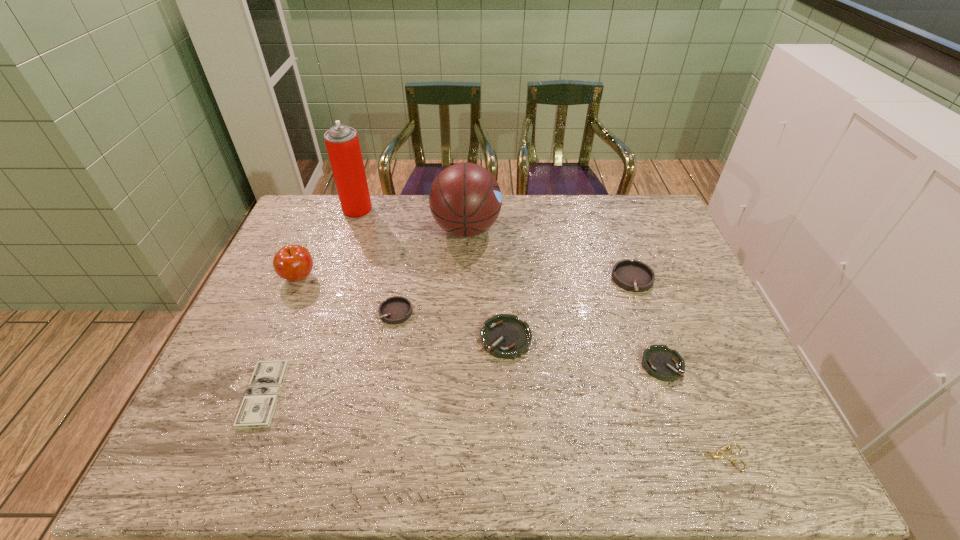
The image size is (960, 540). I want to click on red aerosol can, so pos(342,143).

Image resolution: width=960 pixels, height=540 pixels. I want to click on the tallest object, so click(x=342, y=143).

Find the location of a particular element. Image resolution: width=960 pixels, height=540 pixels. basketball is located at coordinates (465, 199).

I want to click on the third tallest object, so pos(294,263).

Locate an element on the screen. the bigger gray ashtray is located at coordinates (635, 276).

You are a GUI agent. You are given a task and a screenshot of the screen. Output one action in this format:
    pyautogui.click(x=<x>, y=<y>)
    Task: Click on the farthest ashtray
    The image size is (960, 540).
    Given the screenshot: What is the action you would take?
    pyautogui.click(x=635, y=276)

Where is `the left gray ashtray`? the left gray ashtray is located at coordinates (394, 310).

Find the location of a particular element. This screenshot has width=960, height=540. the fourth object from left to right is located at coordinates (394, 310).

Image resolution: width=960 pixels, height=540 pixels. What are the coordinates of `the third ashtray from right to left` in the screenshot? It's located at (505, 336).

At what (x,y) coordinates should I click in order to perform the action: click on the bigger green ashtray. Please return your answer as a coordinate pair (x, y). The width and height of the screenshot is (960, 540). Looking at the image, I should click on (505, 336).